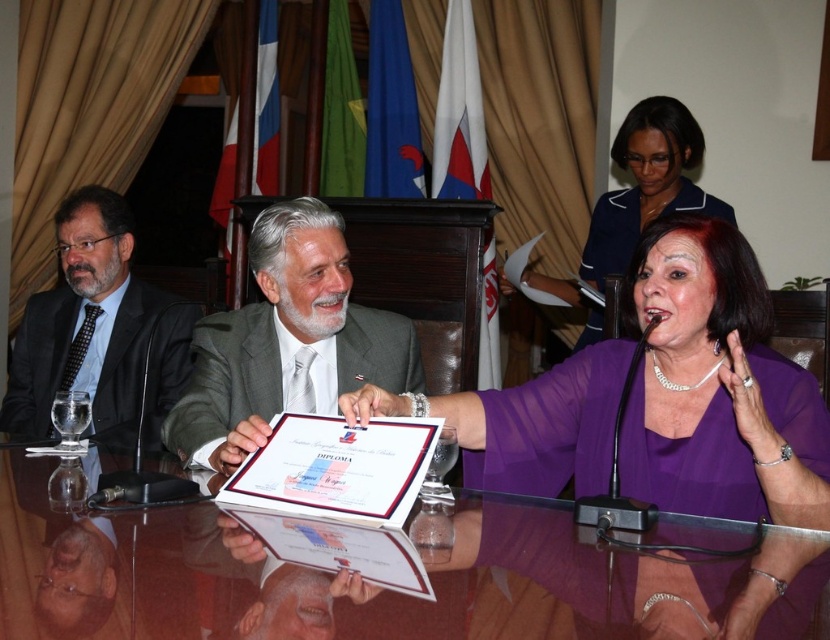
Question: Which object is the closest to the transparent glass table at center?

Choices:
 (A) black suit at left
 (B) matte gray suit at center
 (C) purple satin blouse at center

Answer: (C)

Question: Which of the following is the closest to the observer?

Choices:
 (A) (793, 435)
 (B) (637, 148)

Answer: (A)

Question: Does transparent glass table at center appear on the left side of purple sheer blouse at center?

Choices:
 (A) yes
 (B) no

Answer: (A)

Question: Is transparent glass table at center closer to the viewer compared to purple satin blouse at center?

Choices:
 (A) no
 (B) yes

Answer: (B)

Question: Among these objects, which one is farthest from the camera?

Choices:
 (A) transparent glass table at center
 (B) purple satin blouse at center
 (C) matte gray suit at center
 (D) purple sheer blouse at center

Answer: (D)

Question: Is purple satin blouse at center bigger than purple sheer blouse at center?

Choices:
 (A) yes
 (B) no

Answer: (B)